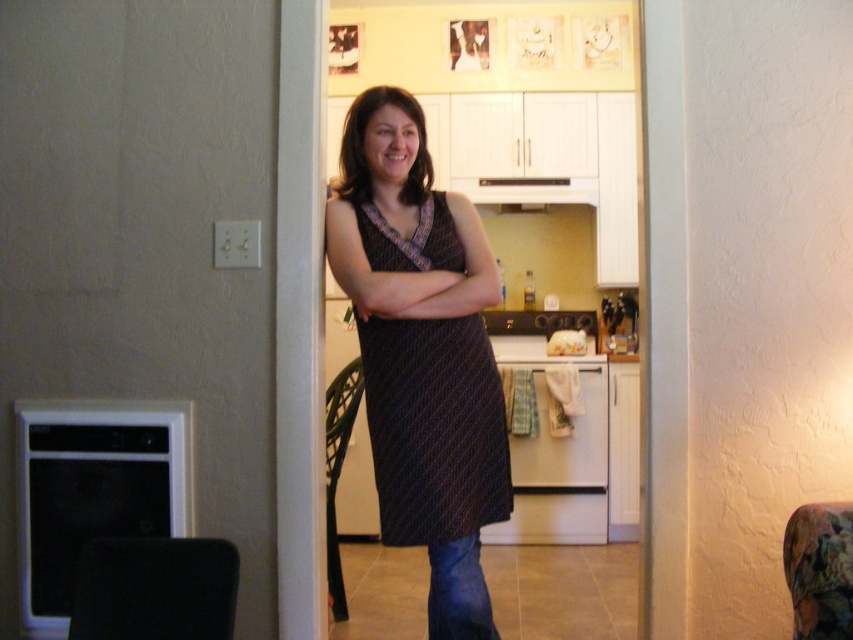
Between dark textured dress at center and matte black dress at center, which one appears on the right side from the viewer's perspective?

Positioned to the right is dark textured dress at center.

What do you see at coordinates (434, 428) in the screenshot? I see `dark textured dress at center` at bounding box center [434, 428].

In order to click on dark textured dress at center in this screenshot , I will do `click(434, 428)`.